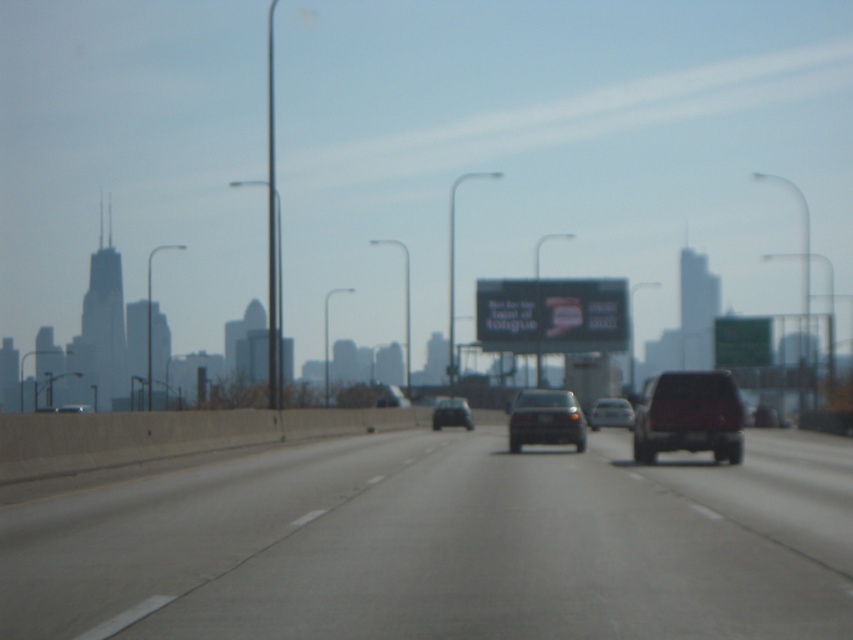
From the picture: Is matte black car at center closer to camera compared to shiny black sedan at center?

Yes, it is.

Who is higher up, matte black car at center or shiny black sedan at center?

matte black car at center

Which is behind, point (579, 417) or point (437, 422)?

Point (437, 422)

The image size is (853, 640). Find the location of `matte black car at center`. matte black car at center is located at coordinates (544, 419).

Does gray asphalt highway at center appear over silver metallic sedan at center?

Correct, gray asphalt highway at center is located above silver metallic sedan at center.

Describe the element at coordinates (444, 545) in the screenshot. The height and width of the screenshot is (640, 853). I see `gray asphalt highway at center` at that location.

Does point (440, 512) lie behind point (631, 412)?

No, (440, 512) is closer to viewer.

Locate an element on the screen. gray asphalt highway at center is located at coordinates (444, 545).

Is dark red matte suv at right smaller than green matte sign at right?

Yes.

Does dark red matte suv at right appear under green matte sign at right?

Indeed, dark red matte suv at right is positioned under green matte sign at right.

Is point (654, 403) farther from viewer compared to point (741, 321)?

No, (654, 403) is in front of (741, 321).

The width and height of the screenshot is (853, 640). What are the coordinates of `dark red matte suv at right` in the screenshot? It's located at (689, 416).